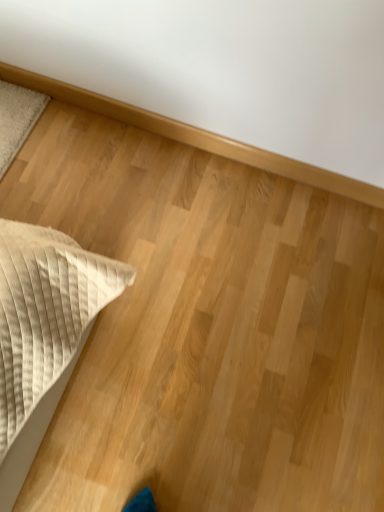
At what (x,y) coordinates should I click in order to perform the action: click on free space on the front side of natural wood baseboard at upper center. Please return your answer as a coordinate pair (x, y). The width and height of the screenshot is (384, 512). Looking at the image, I should click on (195, 286).